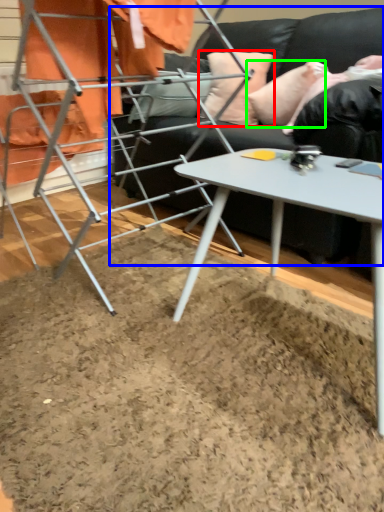
Question: Which object is positioned farthest from pillow (highlighted by a red box)? Select from studio couch (highlighted by a blue box) and pillow (highlighted by a green box).

Choices:
 (A) studio couch
 (B) pillow

Answer: (A)